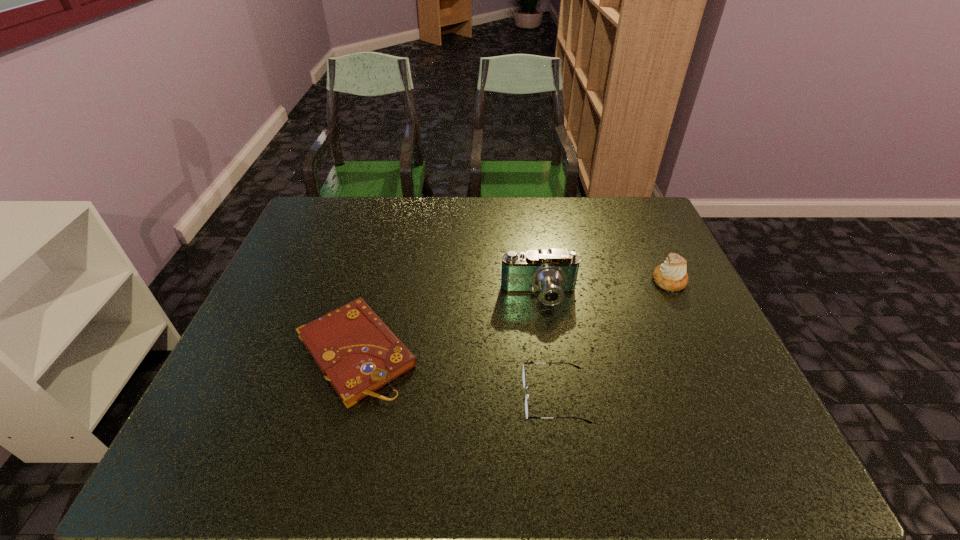
You are a GUI agent. You are given a task and a screenshot of the screen. Output one action in this format:
    pyautogui.click(x=<x>, y=<y>)
    Task: Click on the vacant point located between the rightmost object and the spectacles
    
    Given the screenshot: What is the action you would take?
    pyautogui.click(x=612, y=339)

At what (x,y) coordinates should I click in order to perform the action: click on unoccupied position between the camcorder and the pastry. Please return your answer as a coordinate pair (x, y). This screenshot has width=960, height=540. Looking at the image, I should click on pyautogui.click(x=604, y=288).

Where is `unoccupied area between the leftmost object and the rightmost object`? Image resolution: width=960 pixels, height=540 pixels. unoccupied area between the leftmost object and the rightmost object is located at coordinates (513, 316).

I want to click on free spot between the leftmost object and the spectacles, so click(455, 375).

Find the location of a particular element. The height and width of the screenshot is (540, 960). free point between the camcorder and the notebook is located at coordinates (447, 324).

The image size is (960, 540). What are the coordinates of `free point between the spectacles and the tallest object` in the screenshot? It's located at (547, 347).

Locate an element on the screen. free space between the rightmost object and the spectacles is located at coordinates (612, 339).

This screenshot has width=960, height=540. I want to click on unoccupied area between the notebook and the spectacles, so 455,375.

Find the location of a particular element. the second closest object relative to the notebook is located at coordinates (524, 377).

Identify the location of the second closest object to the notebook. The image size is (960, 540). (524, 377).